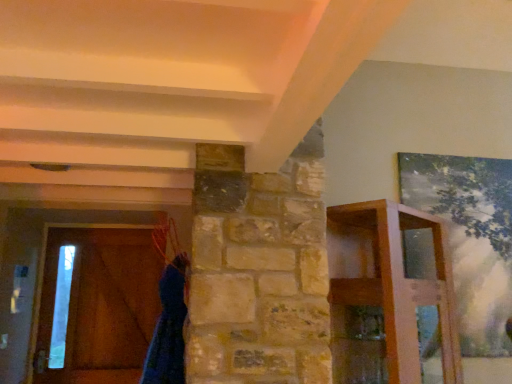
Question: In terms of size, does brown wooden barn door at left appear bigger or smaller than blue fuzzy robe at lower left?

Choices:
 (A) small
 (B) big

Answer: (A)

Question: Choose the correct answer: Is brown wooden barn door at left inside blue fuzzy robe at lower left or outside it?

Choices:
 (A) outside
 (B) inside

Answer: (A)

Question: Considering the real-world distances, which object is farthest from the wooden shelf at right?

Choices:
 (A) brown wooden barn door at left
 (B) blue fuzzy robe at lower left

Answer: (A)

Question: Estimate the real-world distances between objects in this image. Which object is farther from the wooden shelf at right?

Choices:
 (A) brown wooden barn door at left
 (B) blue fuzzy robe at lower left

Answer: (A)